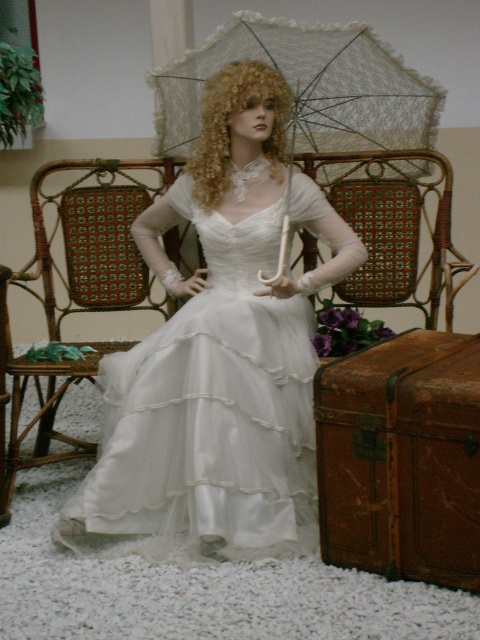
Who is shorter, satin dress at center or blonde curly wig at center?

Standing shorter between the two is blonde curly wig at center.

Is point (231, 97) farther from viewer compared to point (229, 97)?

That is False.

Image resolution: width=480 pixels, height=640 pixels. I want to click on satin dress at center, so click(x=219, y=353).

Can you confirm if white lace umbrella at center is thinner than woven wood chair at center?

Incorrect, white lace umbrella at center's width is not less than woven wood chair at center's.

Locate an element on the screen. white lace umbrella at center is located at coordinates (308, 84).

I want to click on white lace umbrella at center, so click(308, 84).

Can you confirm if white lace umbrella at center is positioned to the left of blonde curly wig at center?

In fact, white lace umbrella at center is to the right of blonde curly wig at center.

What do you see at coordinates (308, 84) in the screenshot? I see `white lace umbrella at center` at bounding box center [308, 84].

At what (x,y) coordinates should I click in order to perform the action: click on white lace umbrella at center. Please return your answer as a coordinate pair (x, y). Looking at the image, I should click on (308, 84).